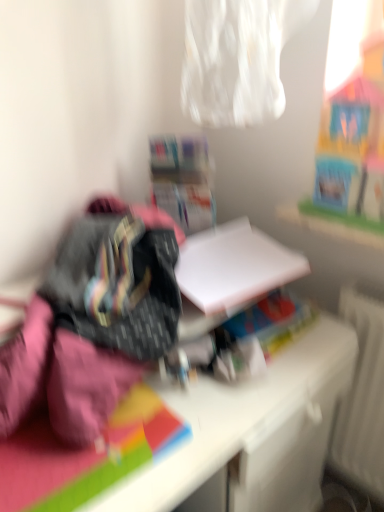
Where is `white matte desk at center`? This screenshot has width=384, height=512. white matte desk at center is located at coordinates (251, 430).

Looking at this image, which object is wider, white cardboard box at center or white matte desk at center?

white matte desk at center.

Is point (187, 220) positioned before point (143, 482)?

No.

Which of these two, white cardboard box at center or white matte desk at center, stands shorter?

white cardboard box at center is shorter.

Consider the image. From a real-world perspective, which object rests below the other?

white matte desk at center, from a real-world perspective.

Based on the photo, is white matte desk at center beside white cardboard box at center?

No, white matte desk at center is not touching white cardboard box at center.

This screenshot has height=512, width=384. Find the location of `desk below the white cardboard box at center (from the image's perspective)`. desk below the white cardboard box at center (from the image's perspective) is located at coordinates (251, 430).

Is white matte desk at center positioned behind white cardboard box at center?

No, white matte desk at center is closer to the viewer.

What's the angular difference between white matte desk at center and white cardboard box at center's facing directions?

There is a 40-degree angle between the facing directions of white matte desk at center and white cardboard box at center.

From the picture: Would you consider white matte paper at center to be distant from white matte desk at center?

No, white matte paper at center is not far away from white matte desk at center.

From the image's perspective, would you say white matte paper at center is positioned over white matte desk at center?

Yes, from the image's perspective, white matte paper at center is on top of white matte desk at center.

Measure the distance between white matte paper at center and white matte desk at center.

A distance of 10.64 inches exists between white matte paper at center and white matte desk at center.

Is white matte paper at center spatially inside white matte desk at center, or outside of it?

white matte paper at center is located beyond the bounds of white matte desk at center.

From a real-world perspective, does white cardboard box at center sit lower than white matte paper at center?

Incorrect, from a real-world perspective, white cardboard box at center is higher than white matte paper at center.

Is white cardboard box at center inside or outside of white matte paper at center?

white cardboard box at center is spatially situated outside white matte paper at center.

Can you tell me how much white cardboard box at center and white matte paper at center differ in facing direction?

The facing directions of white cardboard box at center and white matte paper at center are 29.7 degrees apart.

Considering the sizes of objects white matte desk at center and white matte paper at center in the image provided, who is shorter, white matte desk at center or white matte paper at center?

white matte paper at center.

Does white matte desk at center appear on the left side of white matte paper at center?

Yes.

Does white matte desk at center turn towards white matte paper at center?

No, white matte desk at center is not turned towards white matte paper at center.

Which is more to the left, white matte paper at center or white cardboard box at center?

Positioned to the left is white cardboard box at center.

Who is taller, white matte paper at center or white cardboard box at center?

With more height is white cardboard box at center.

Can you tell me how much white matte paper at center and white cardboard box at center differ in facing direction?

29.7 degrees.

You are a GUI agent. You are given a task and a screenshot of the screen. Output one action in this format:
    pyautogui.click(x=<x>, y=<y>)
    Task: Click on the shelf that is above the white matte paper at center (from a real-world perspective)
    
    Given the screenshot: What is the action you would take?
    pyautogui.click(x=182, y=181)

There is a white matte desk at center. Where is `shelf above it (from a real-world perspective)`? The height and width of the screenshot is (512, 384). shelf above it (from a real-world perspective) is located at coordinates (182, 181).

This screenshot has height=512, width=384. I want to click on desk that is on the left side of white cardboard box at center, so click(251, 430).

Based on their spatial positions, is white matte desk at center or white cardboard box at center closer to white matte paper at center?

white cardboard box at center lies closer to white matte paper at center than the other object.

Which object lies further to the anchor point white matte desk at center, white cardboard box at center or white matte paper at center?

white cardboard box at center is further to white matte desk at center.

Looking at the image, which one is located closer to white matte paper at center, white cardboard box at center or white matte desk at center?

Based on the image, white cardboard box at center appears to be nearer to white matte paper at center.

Looking at the image, which one is located closer to white matte desk at center, white matte paper at center or white cardboard box at center?

white matte paper at center is positioned closer to the anchor white matte desk at center.

Estimate the real-world distances between objects in this image. Which object is closer to white cardboard box at center, white matte paper at center or white matte desk at center?

white matte paper at center is positioned closer to the anchor white cardboard box at center.

Which object lies further to the anchor point white cardboard box at center, white matte desk at center or white matte paper at center?

white matte desk at center lies further to white cardboard box at center than the other object.

Find the location of a particular element. The height and width of the screenshot is (512, 384). paperback book between white cardboard box at center and white matte desk at center in the up-down direction is located at coordinates (234, 267).